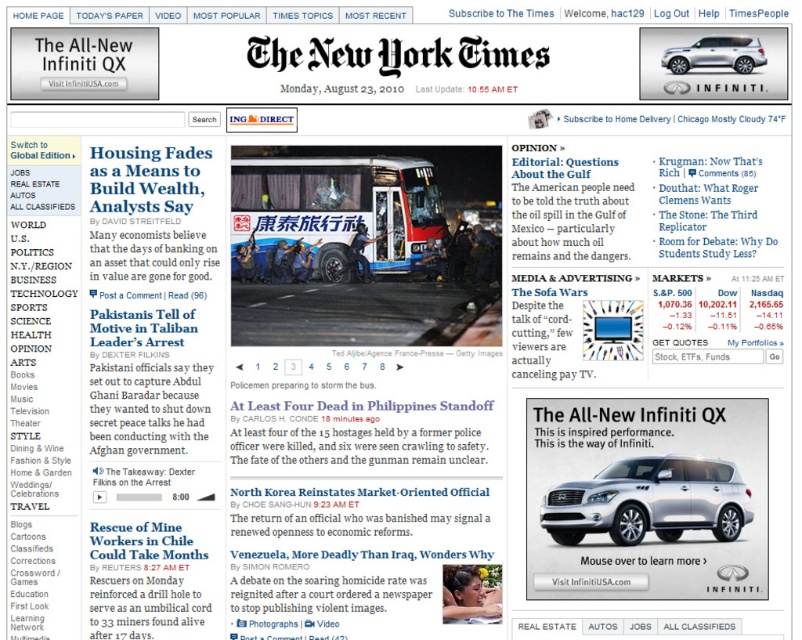
Question: Which of the following is the closest to the observer?

Choices:
 (A) 691,65
 (B) 722,483

Answer: (B)

Question: Which point appears closest to the camera in this image?

Choices:
 (A) (626, 541)
 (B) (693, 44)

Answer: (A)

Question: Which point is closer to the camera?

Choices:
 (A) (683, 72)
 (B) (626, 500)

Answer: (B)

Question: Does silver metallic suv at center have a larger size compared to satin silver suv at upper right?

Choices:
 (A) yes
 (B) no

Answer: (A)

Question: Is silver metallic suv at center positioned in front of satin silver suv at upper right?

Choices:
 (A) no
 (B) yes

Answer: (B)

Question: Is silver metallic suv at center positioned behind satin silver suv at upper right?

Choices:
 (A) no
 (B) yes

Answer: (A)